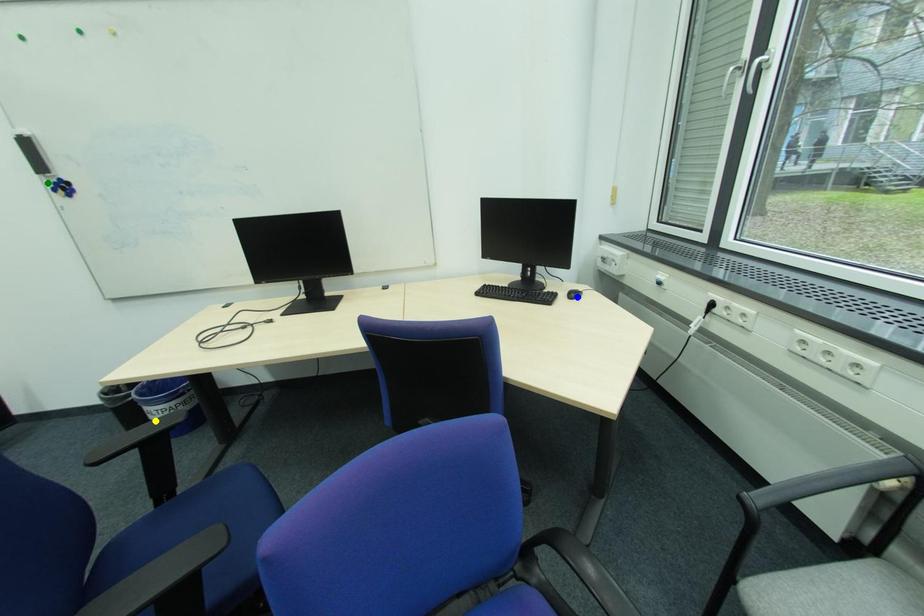
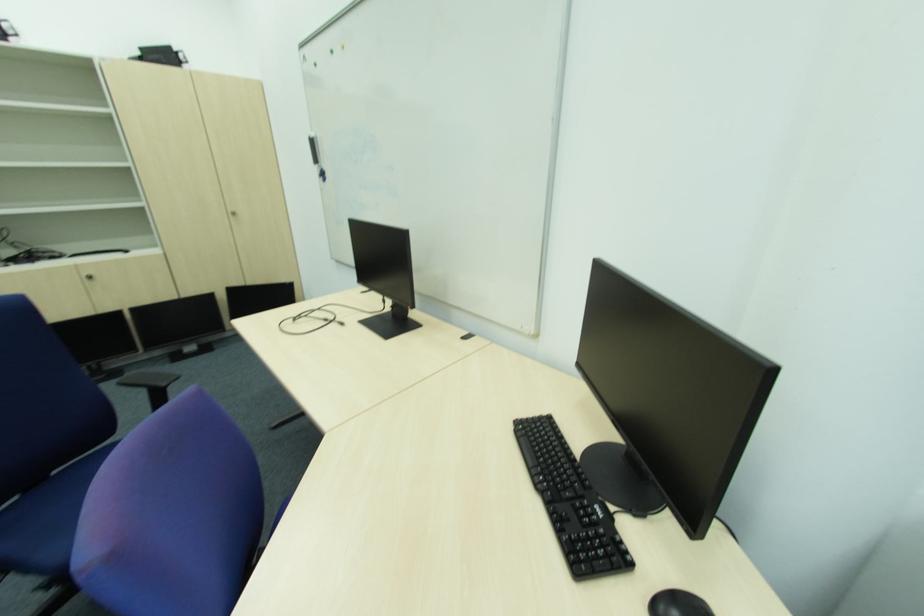
I am providing you with two images of the same scene from different viewpoints. Three points are marked in image1. Which point corresponds to a part or object that is occluded in image2?In image1, three points are marked. Which of them correspond to a part or object that is occluded in image2?Among the three points shown in image1, which one corresponds to a part or object that is no longer visible due to occlusion in image2?

Invisible in image2: yellow point.